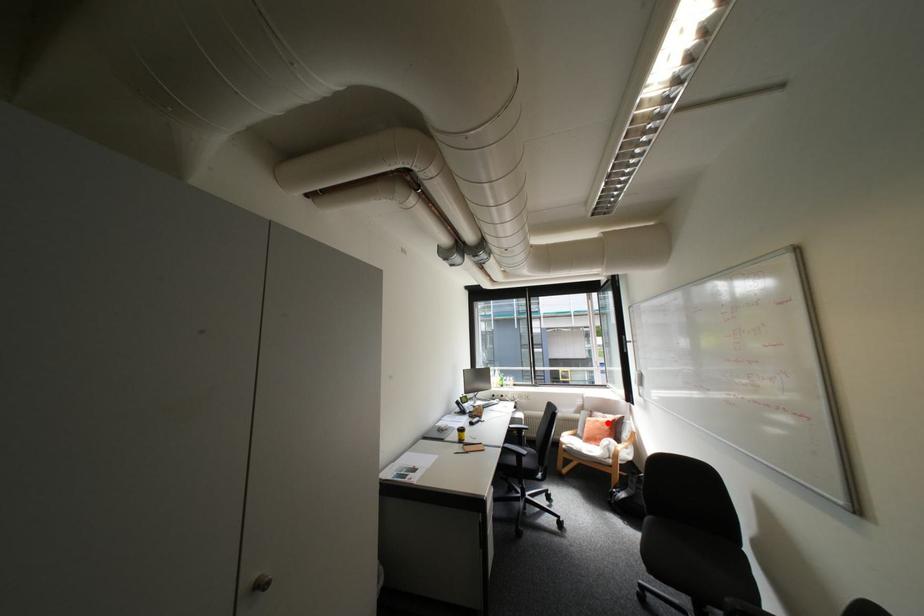
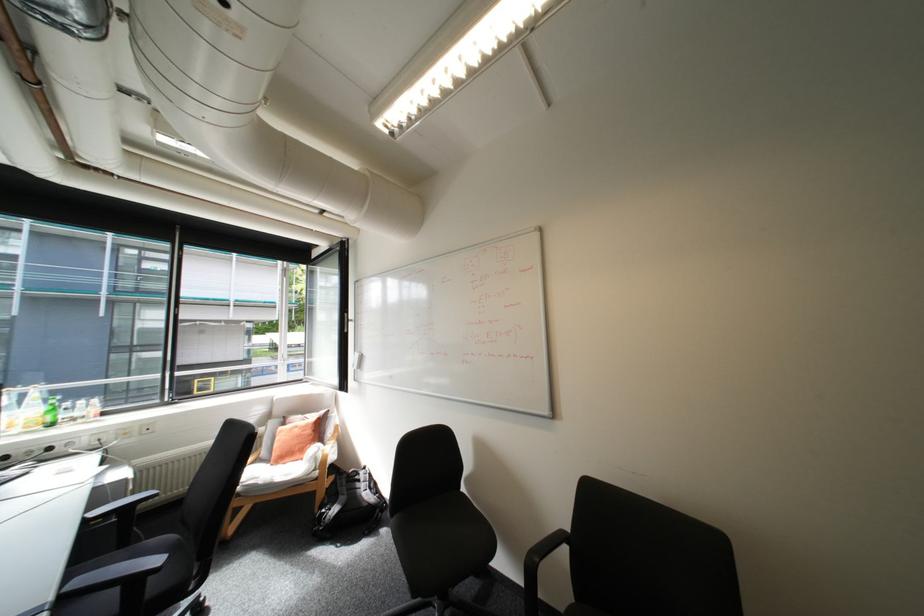
In the second image, find the point that corresponds to the highlighted location in the first image.

(307, 429)